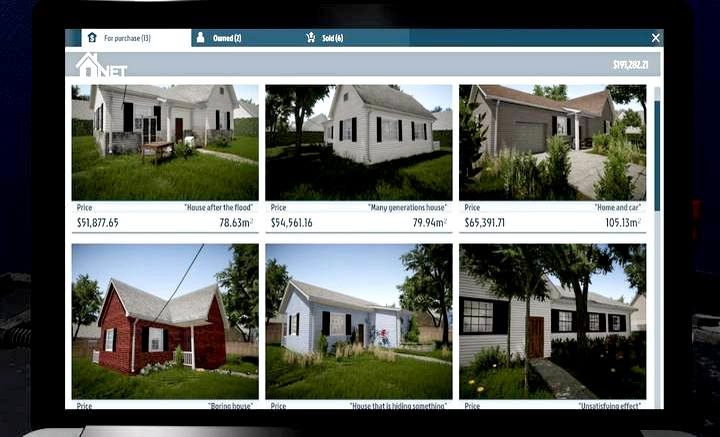
The width and height of the screenshot is (720, 437). What are the coordinates of `door` in the screenshot? It's located at (536, 335), (179, 123), (359, 329).